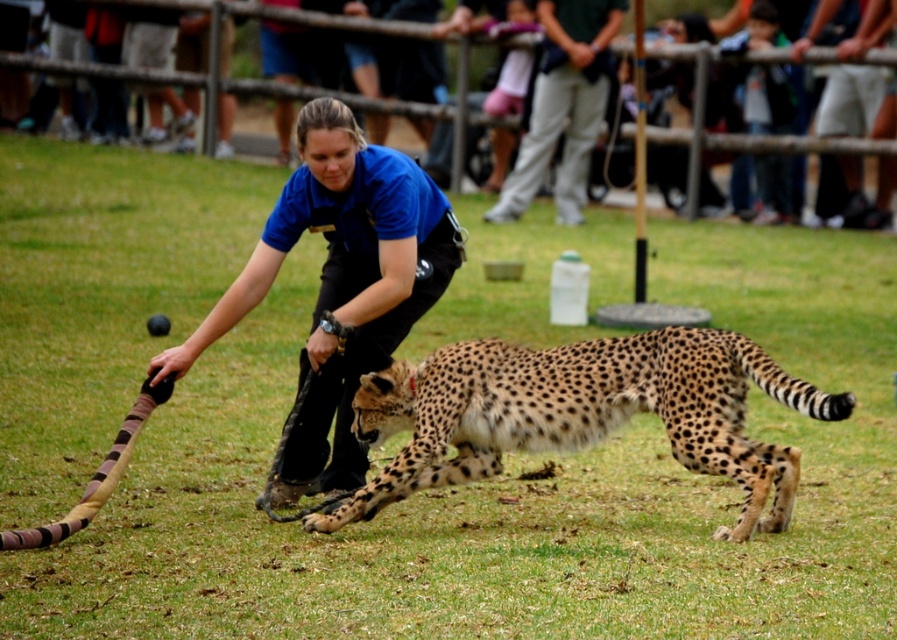
Which is above, spotted fur cheetah at center or light pink fabric at upper center?

light pink fabric at upper center is higher up.

In the scene shown: Is spotted fur cheetah at center wider than light pink fabric at upper center?

Yes.

Find the location of a particular element. This screenshot has width=897, height=640. spotted fur cheetah at center is located at coordinates (580, 413).

Find the location of a particular element. The height and width of the screenshot is (640, 897). spotted fur cheetah at center is located at coordinates (580, 413).

Does spotted fur cheetah at center have a lesser height compared to blue uniform at center?

Yes.

Does spotted fur cheetah at center have a greater width compared to blue uniform at center?

Yes.

Find the location of a particular element. This screenshot has width=897, height=640. spotted fur cheetah at center is located at coordinates (580, 413).

Is point (449, 273) behind point (582, 179)?

No.

Is point (253, 294) positioned before point (558, 32)?

That is True.

Between point (292, 189) and point (617, 8), which one is positioned behind?

Positioned behind is point (617, 8).

Locate an element on the screen. The height and width of the screenshot is (640, 897). blue uniform at center is located at coordinates (340, 280).